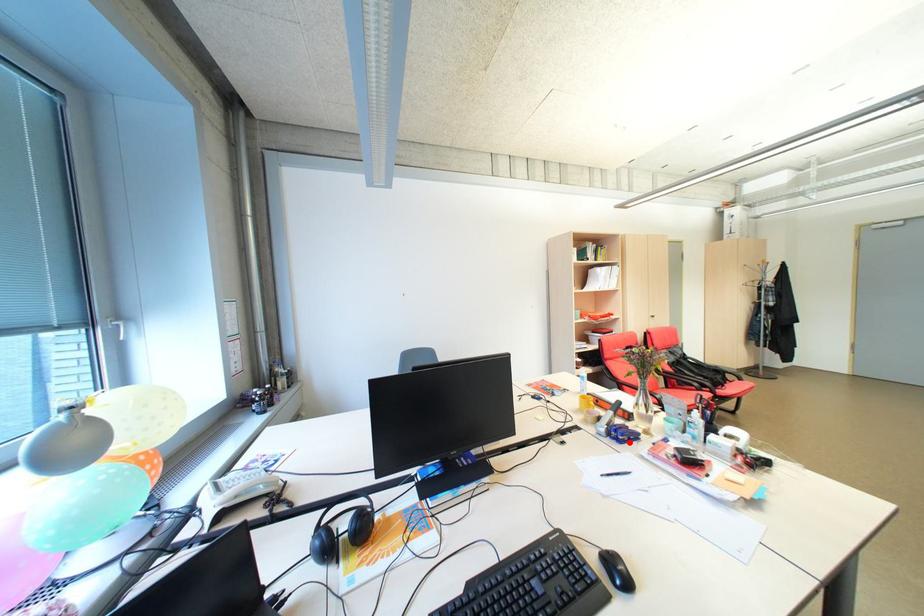
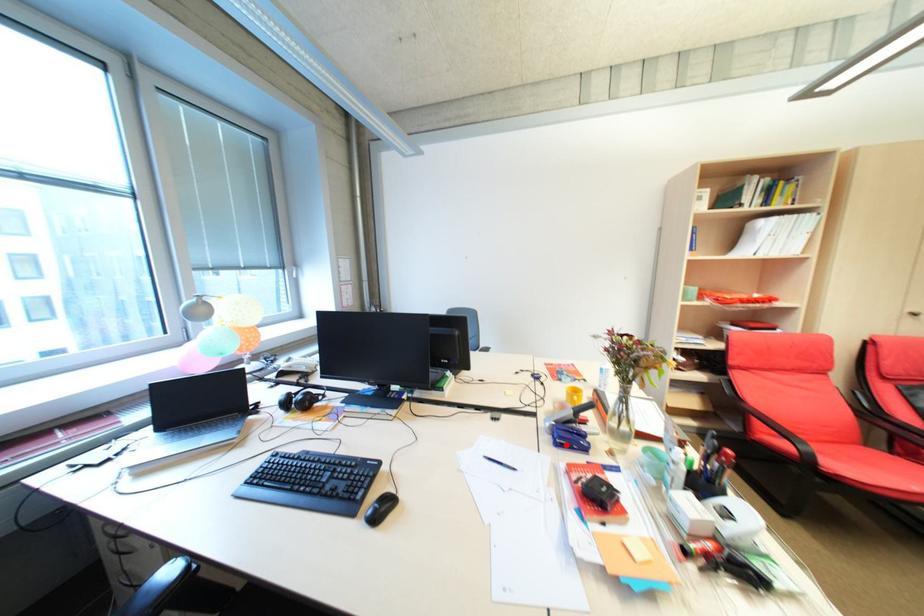
I am providing you with two images of the same scene from different viewpoints. A red point is marked on the first image and another point is marked on the second image. Is the marked point in image1 the same physical position as the marked point in image2?

Yes